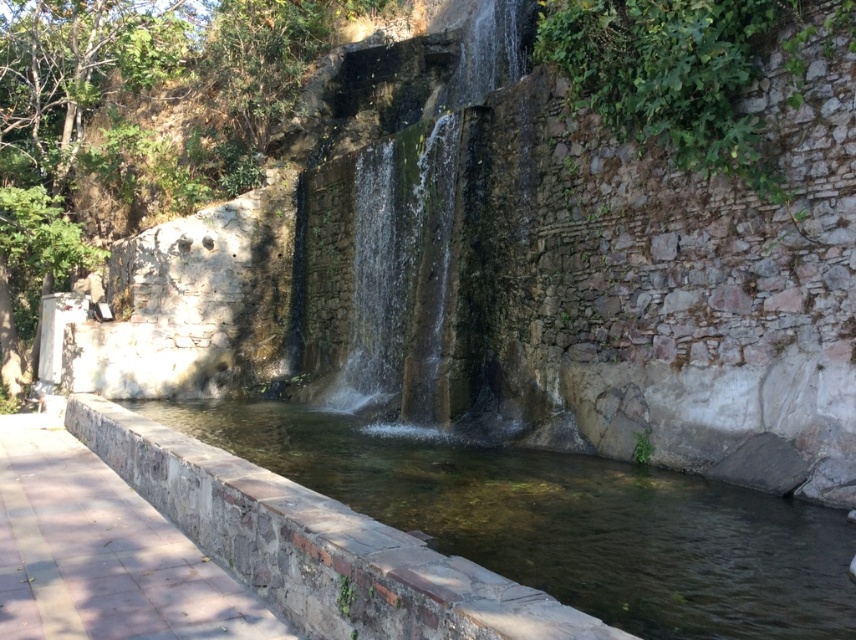
Question: Is clear stone stream at center closer to the viewer compared to smooth stone waterfall at center?

Choices:
 (A) yes
 (B) no

Answer: (A)

Question: Which point is closer to the camera?

Choices:
 (A) smooth stone waterfall at center
 (B) clear stone stream at center

Answer: (B)

Question: From the image, what is the correct spatial relationship of clear stone stream at center in relation to smooth stone waterfall at center?

Choices:
 (A) above
 (B) below

Answer: (B)

Question: Does clear stone stream at center have a smaller size compared to smooth stone waterfall at center?

Choices:
 (A) yes
 (B) no

Answer: (A)

Question: Which point is closer to the camera?

Choices:
 (A) (366, 490)
 (B) (449, 163)

Answer: (A)